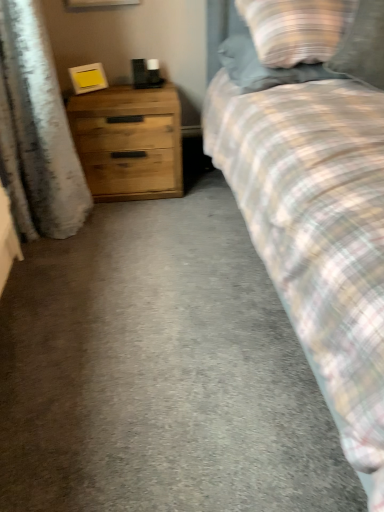
Question: From a real-world perspective, is plaid fabric pillow at upper right, marked as the first pillow in a left-to-right arrangement, above or below wooden chest of drawers at left?

Choices:
 (A) above
 (B) below

Answer: (A)

Question: In terms of width, does plaid fabric pillow at upper right, acting as the second pillow starting from the right, look wider or thinner when compared to wooden chest of drawers at left?

Choices:
 (A) thin
 (B) wide

Answer: (B)

Question: Which object is the farthest from the plaid fabric pillow at upper right, the first pillow from the right?

Choices:
 (A) white textured curtain at left
 (B) wooden chest of drawers at left
 (C) plaid fabric pillow at upper right, acting as the second pillow starting from the right

Answer: (A)

Question: Which object is the farthest from the plaid fabric pillow at upper right, marked as the first pillow in a left-to-right arrangement?

Choices:
 (A) wooden chest of drawers at left
 (B) plaid fabric pillow at upper right, the first pillow from the right
 (C) white textured curtain at left

Answer: (C)